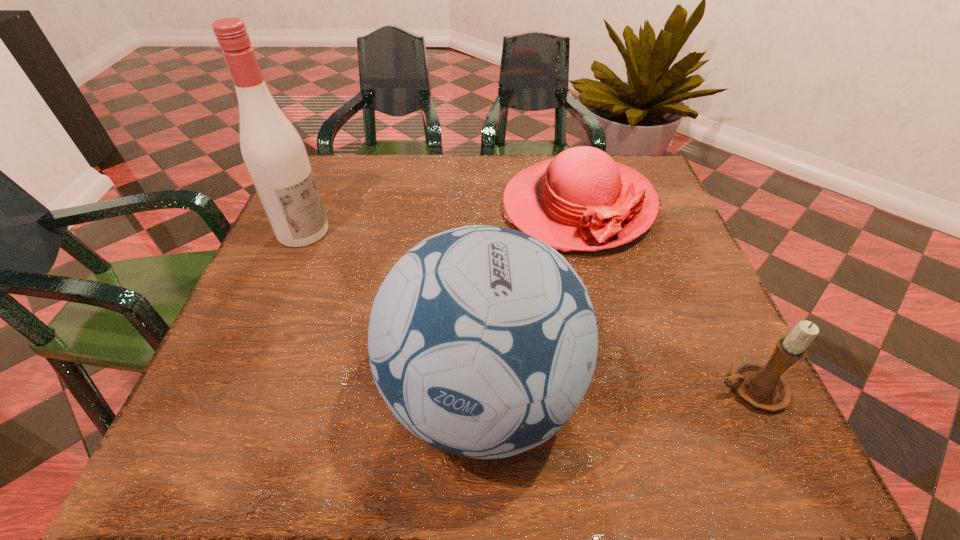
You are a GUI agent. You are given a task and a screenshot of the screen. Output one action in this format:
    pyautogui.click(x=<x>, y=<y>)
    Task: Click on the vacant space located at the front of the hat with a bow
    The image size is (960, 540).
    Given the screenshot: What is the action you would take?
    pyautogui.click(x=629, y=401)

Locate an element on the screen. Image resolution: width=960 pixels, height=540 pixels. free location located on the label of the leftmost object is located at coordinates (443, 307).

The image size is (960, 540). Find the location of `vacant space positioned on the label of the leftmost object`. vacant space positioned on the label of the leftmost object is located at coordinates (343, 253).

In order to click on free region located on the label of the leftmost object in this screenshot , I will do `click(390, 278)`.

Identify the location of object that is at the far edge. (582, 200).

Where is `soccer ball that is at the near edge`? soccer ball that is at the near edge is located at coordinates (482, 340).

The image size is (960, 540). Find the location of `candle holder located at the near edge`. candle holder located at the near edge is located at coordinates (761, 385).

Where is `object that is at the left edge`? Image resolution: width=960 pixels, height=540 pixels. object that is at the left edge is located at coordinates (273, 151).

Find the location of a particular element. This screenshot has width=960, height=540. candle holder that is at the right edge is located at coordinates (761, 385).

Locate an element on the screen. The height and width of the screenshot is (540, 960). hat present at the right edge is located at coordinates (582, 200).